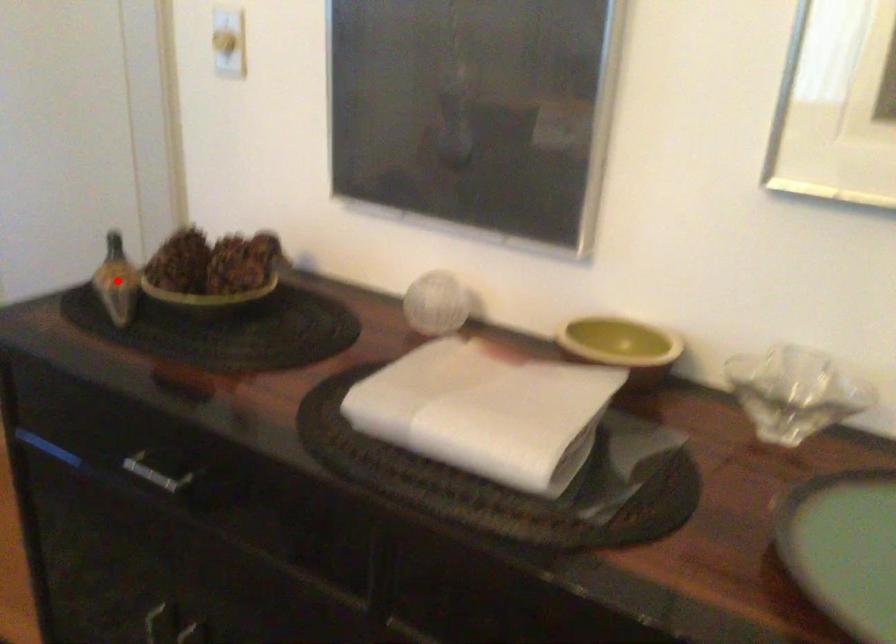
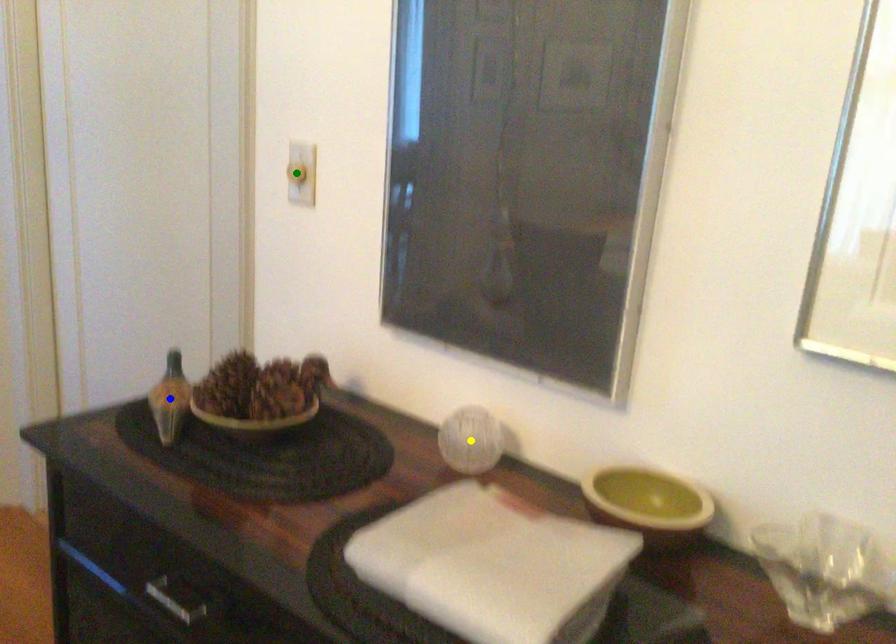
Question: I am providing you with two images of the same scene from different viewpoints. A red point is marked on the first image. You are given multiple points on the second image. In image 2, which mark is for the same physical point as the one in image 1?

Choices:
 (A) green point
 (B) blue point
 (C) yellow point

Answer: (B)